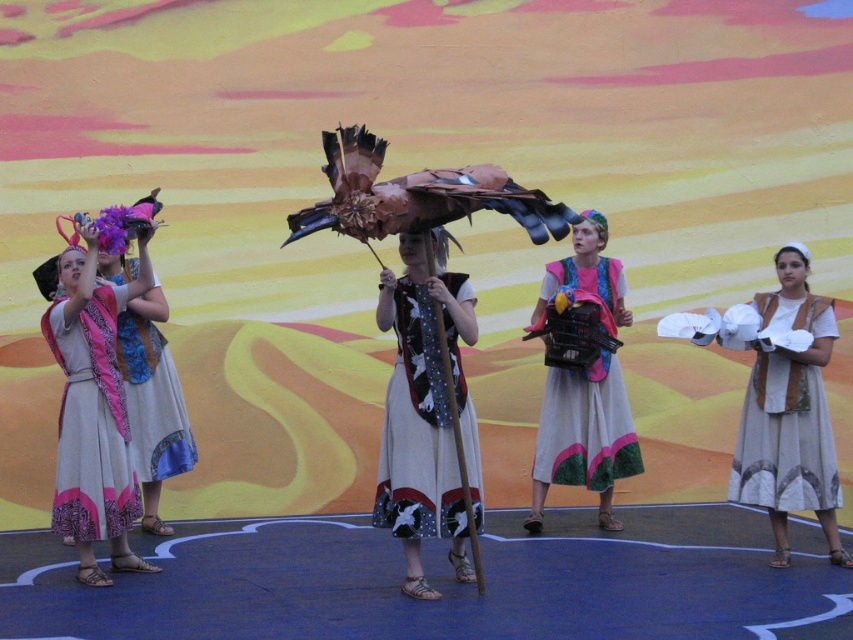
Question: Is white cotton dress at center to the right of matte pink scarf at left from the viewer's perspective?

Choices:
 (A) yes
 (B) no

Answer: (A)

Question: Is white cotton dress at center wider than white cotton gloves at center?

Choices:
 (A) no
 (B) yes

Answer: (A)

Question: Is matte pink scarf at left above matte blue fabric dress at left?

Choices:
 (A) no
 (B) yes

Answer: (A)

Question: Considering the real-world distances, which object is farthest from the matte pink fabric dress at center?

Choices:
 (A) white cotton dress at center
 (B) matte blue fabric dress at left

Answer: (A)

Question: Which of the following is the closest to the observer?

Choices:
 (A) matte pink scarf at left
 (B) matte pink fabric dress at center

Answer: (A)

Question: Among these points, which one is farthest from the camera?

Choices:
 (A) (770, 401)
 (B) (96, 376)

Answer: (A)